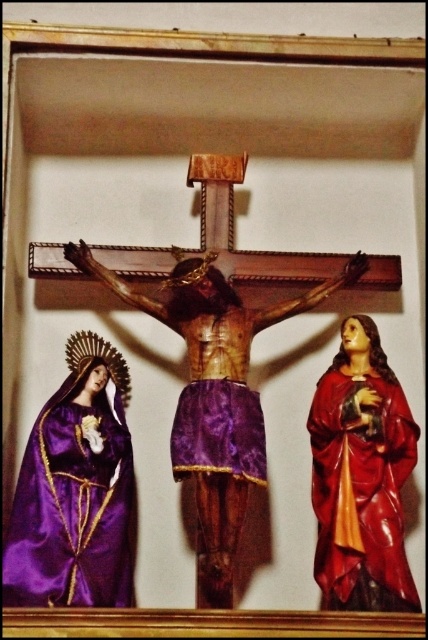
Question: Based on their relative distances, which object is nearer to the shiny red robe at right?

Choices:
 (A) velvet purple robe at left
 (B) velvet purple robe at center

Answer: (B)

Question: Considering the relative positions of velvet purple robe at left and shiny red robe at right in the image provided, where is velvet purple robe at left located with respect to shiny red robe at right?

Choices:
 (A) right
 (B) left

Answer: (B)

Question: Which object is the farthest from the velvet purple robe at left?

Choices:
 (A) shiny red robe at right
 (B) velvet purple robe at center

Answer: (A)

Question: Is velvet purple robe at left below shiny red robe at right?

Choices:
 (A) yes
 (B) no

Answer: (B)

Question: Estimate the real-world distances between objects in this image. Which object is farther from the velvet purple robe at left?

Choices:
 (A) shiny red robe at right
 (B) velvet purple robe at center

Answer: (A)

Question: Does shiny red robe at right appear on the left side of velvet purple robe at center?

Choices:
 (A) no
 (B) yes

Answer: (A)